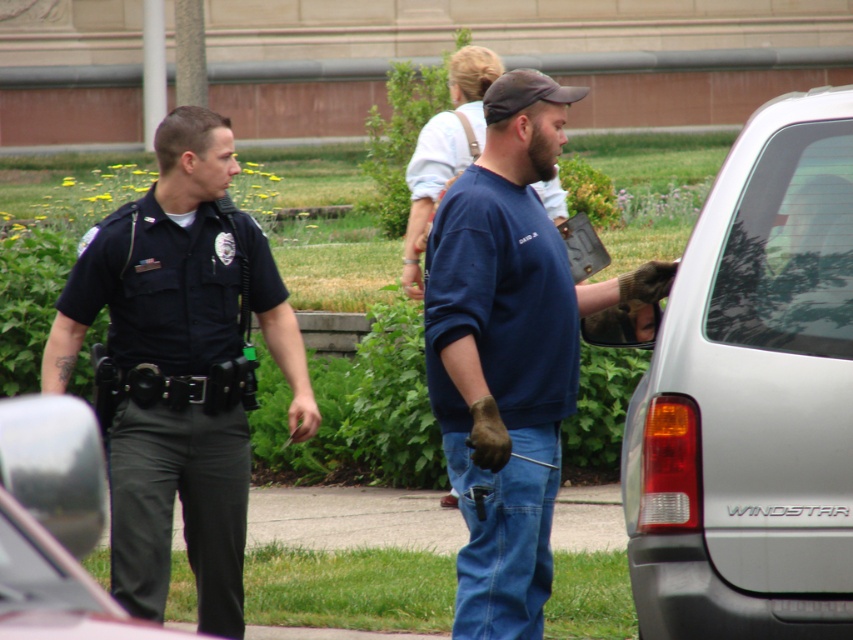
You are a pedestrian standing at the center of the walkway. You want to cross to the other side without getting too close to the two people near the van. The two people are wearing dark blue uniform at left and black matte pants at left. What is the minimum distance you should keep from them to safely pass?

The minimum distance you should keep from the dark blue uniform at left and black matte pants at left is 8.14 feet to ensure safe passage.

Consider the image. What is the spatial coordinate of the silver metallic van at right?

The silver metallic van at right is located at coordinate point (752, 396).

You are a delivery person who needs to load a package onto the silver metallic van at right. The package is taller than the blue cotton sweatshirt at center. Will the package fit inside the van?

The silver metallic van at right is much taller than the blue cotton sweatshirt at center. Since the package is taller than the blue cotton sweatshirt at center, it will still fit inside the van as the van is taller.